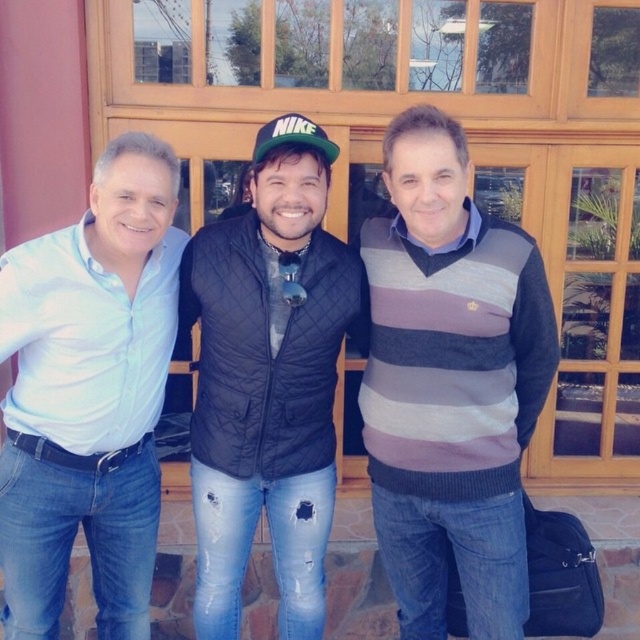
You are a photographer setting up a shot of the three people in front of the wooden door. You need to ensure that the striped sweater at center and the green matte baseball cap at center are both visible. Based on their positions, which one is closer to the bottom of the frame?

The striped sweater at center is below the green matte baseball cap at center, so the striped sweater at center is closer to the bottom of the frame.

You are taking a photo of the striped sweater at center and the black quilted vest at center. Which one is closer to the camera?

The striped sweater at center is in front of the black quilted vest at center, so it is closer to the camera.

You are a photographer setting up for a group photo. You notice the striped sweater at center and the light blue cotton shirt at left. Which clothing item is positioned higher in the frame?

The striped sweater at center is positioned higher in the frame than the light blue cotton shirt at left because it is above it.